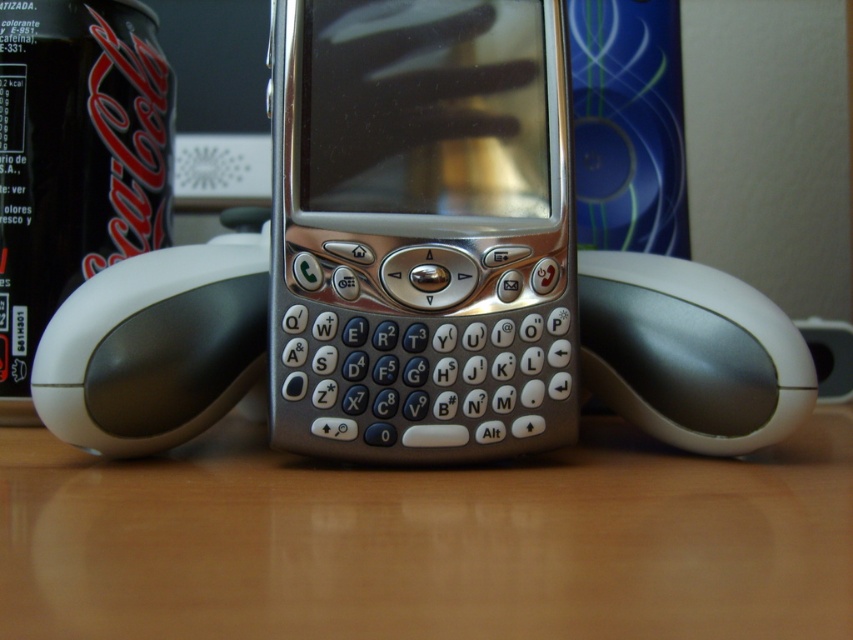
In the scene shown: Between wooden table at center and silver/plastic mouse at center, which one is positioned higher?

silver/plastic mouse at center is above.

How far apart are wooden table at center and silver/plastic mouse at center?

wooden table at center and silver/plastic mouse at center are 5.45 inches apart.

The width and height of the screenshot is (853, 640). I want to click on wooden table at center, so click(x=428, y=540).

From the picture: Does silver metallic smartphone at center appear on the left side of silver/plastic mouse at center?

No, silver metallic smartphone at center is not to the left of silver/plastic mouse at center.

Where is `silver metallic smartphone at center`? This screenshot has width=853, height=640. silver metallic smartphone at center is located at coordinates point(421,230).

Does point (526, 42) come behind point (97, 449)?

Yes, it is.

The width and height of the screenshot is (853, 640). What are the coordinates of `silver metallic smartphone at center` in the screenshot? It's located at (421, 230).

Is black matte can at left above white glossy mouse at center?

Yes.

Between point (51, 289) and point (701, 420), which one is positioned in front?

Point (701, 420)

At what (x,y) coordinates should I click in order to perform the action: click on black matte can at left. Please return your answer as a coordinate pair (x, y). Looking at the image, I should click on (74, 161).